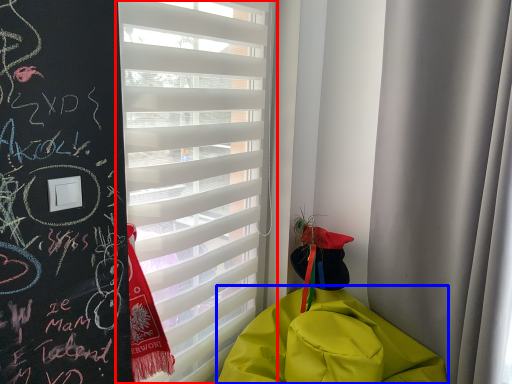
Question: Which of the following is the closest to the observer, window blind (highlighted by a red box) or blanket (highlighted by a blue box)?

Choices:
 (A) window blind
 (B) blanket

Answer: (B)